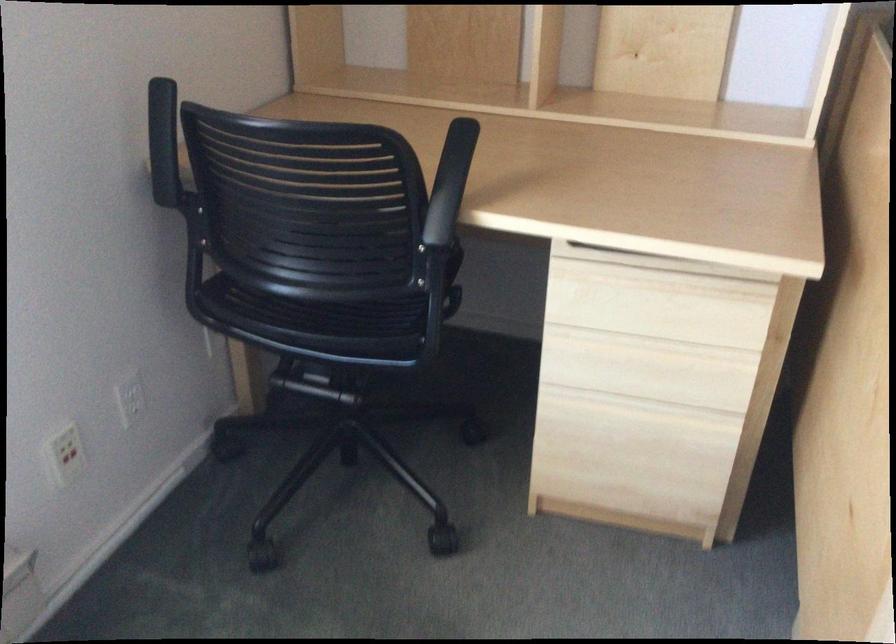
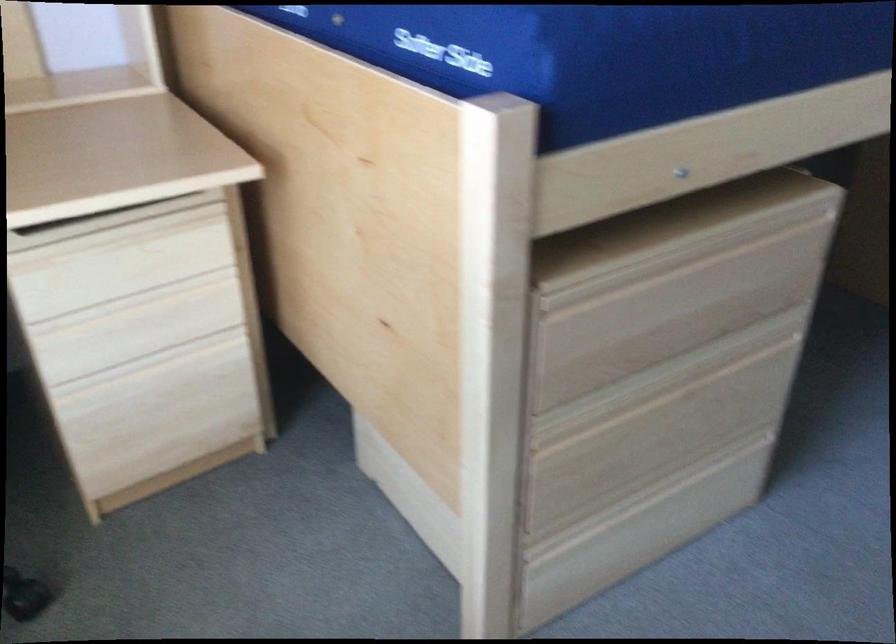
Question: The camera is either moving clockwise (left) or counter-clockwise (right) around the object. The first image is from the beginning of the video and the second image is from the end. Is the camera moving left or right when shooting the video?

Choices:
 (A) Left
 (B) Right

Answer: (A)